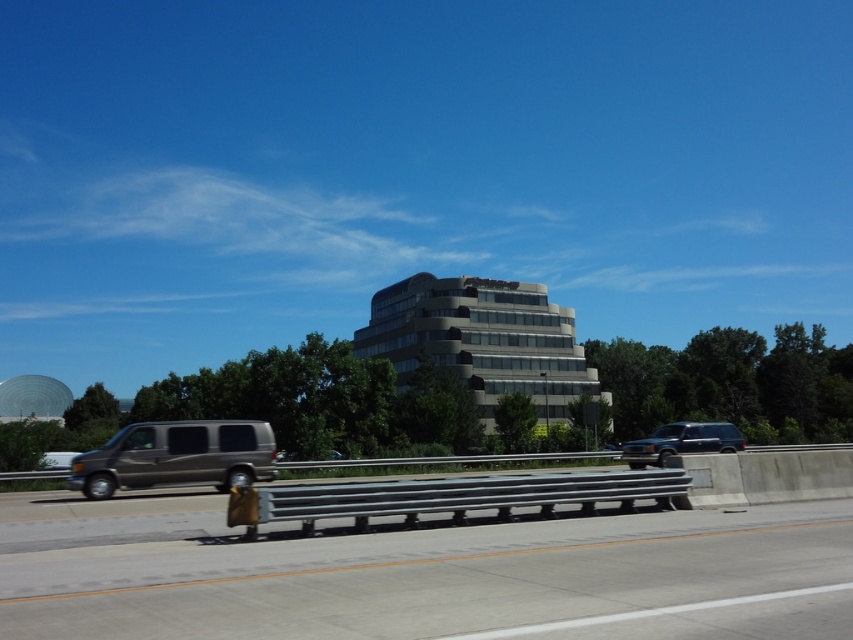
Question: Is gray concrete barrier at lower center bigger than metallic gray suv at right?

Choices:
 (A) no
 (B) yes

Answer: (A)

Question: Is matte metallic van at lower left further to camera compared to metallic gray suv at right?

Choices:
 (A) no
 (B) yes

Answer: (A)

Question: Which is farther from the gray concrete barrier at lower center?

Choices:
 (A) metallic gray suv at right
 (B) matte metallic van at lower left

Answer: (A)

Question: Which of these objects is positioned farthest from the gray concrete barrier at lower center?

Choices:
 (A) metallic gray suv at right
 (B) matte metallic van at lower left

Answer: (A)

Question: Can you confirm if gray concrete barrier at lower center is wider than matte metallic van at lower left?

Choices:
 (A) yes
 (B) no

Answer: (A)

Question: Estimate the real-world distances between objects in this image. Which object is farther from the matte metallic van at lower left?

Choices:
 (A) gray concrete barrier at lower center
 (B) metallic gray suv at right

Answer: (B)